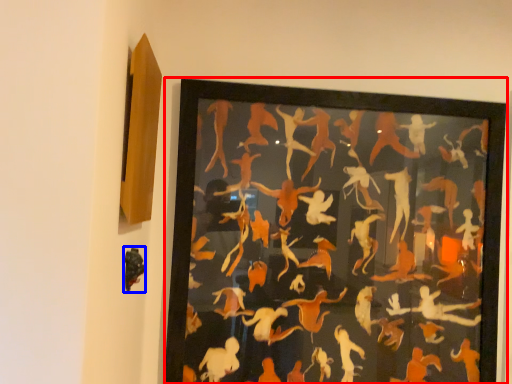
Question: Which object appears farthest to the camera in this image, picture frame (highlighted by a red box) or animal (highlighted by a blue box)?

Choices:
 (A) picture frame
 (B) animal

Answer: (A)